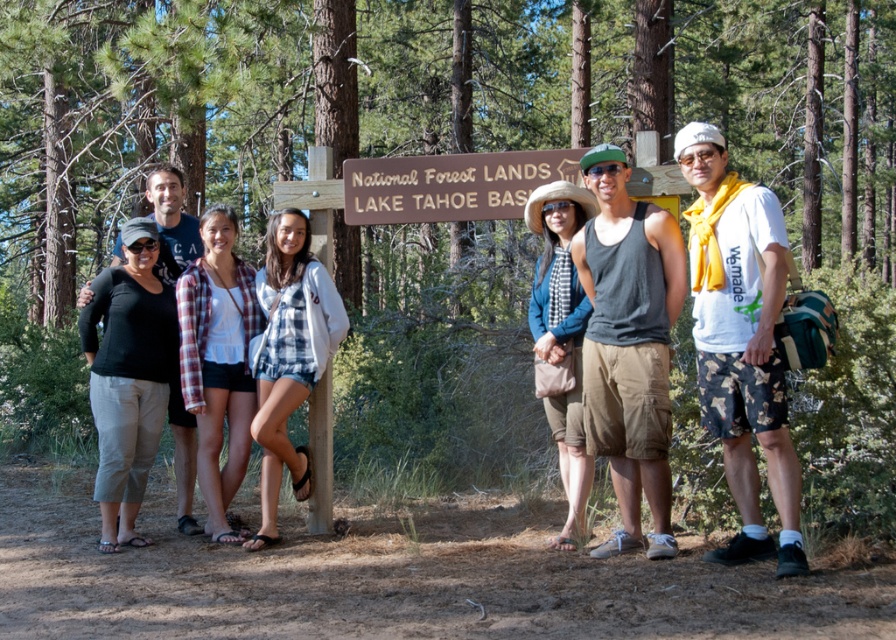
Question: Among these objects, which one is farthest from the camera?

Choices:
 (A) white cotton t-shirt at center
 (B) brown dirt trail at lower center
 (C) brown wooden sign at center

Answer: (C)

Question: Estimate the real-world distances between objects in this image. Which object is farther from the white cotton t-shirt at center?

Choices:
 (A) brown wooden sign at center
 (B) brown dirt trail at lower center

Answer: (B)

Question: Does brown dirt trail at lower center come in front of white cotton t-shirt at center?

Choices:
 (A) no
 (B) yes

Answer: (B)

Question: Can you confirm if brown dirt trail at lower center is wider than white cotton t-shirt at center?

Choices:
 (A) no
 (B) yes

Answer: (B)

Question: Can you confirm if brown dirt trail at lower center is positioned below brown wooden sign at center?

Choices:
 (A) yes
 (B) no

Answer: (A)

Question: Which of the following is the farthest from the observer?

Choices:
 (A) brown dirt trail at lower center
 (B) brown wooden sign at center
 (C) white cotton t-shirt at center

Answer: (B)